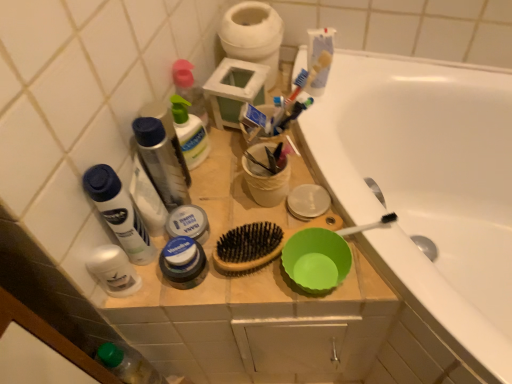
The width and height of the screenshot is (512, 384). What are the coordinates of `vacant area that is situated to the right of white matte jar at center, which is the 3th toiletry in top-to-bottom order` in the screenshot? It's located at (x=270, y=224).